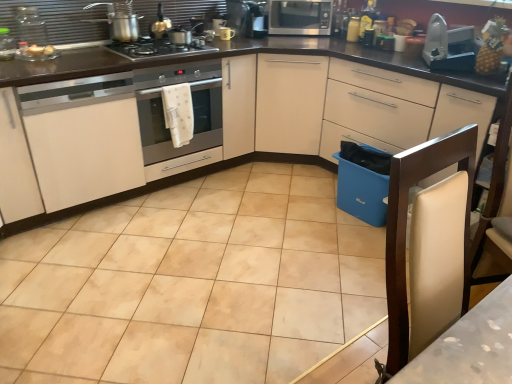
Question: Are satin silver microwave at upper center and white leather chair at right making contact?

Choices:
 (A) no
 (B) yes

Answer: (A)

Question: Does satin silver microwave at upper center come behind white leather chair at right?

Choices:
 (A) no
 (B) yes

Answer: (B)

Question: From a real-world perspective, is satin silver microwave at upper center positioned over white leather chair at right based on gravity?

Choices:
 (A) no
 (B) yes

Answer: (B)

Question: Is satin silver microwave at upper center turned away from white leather chair at right?

Choices:
 (A) yes
 (B) no

Answer: (B)

Question: Considering the relative positions of satin silver microwave at upper center and white leather chair at right in the image provided, is satin silver microwave at upper center to the right of white leather chair at right from the viewer's perspective?

Choices:
 (A) no
 (B) yes

Answer: (A)

Question: Is white matte cabinet at left, the first cabinetry positioned from the left, in front of or behind metallic silver kettle at upper center, arranged as the fifth appliance when viewed from the right, in the image?

Choices:
 (A) behind
 (B) front

Answer: (B)

Question: Is white matte cabinet at left, the second cabinetry from the right, wider or thinner than metallic silver kettle at upper center, arranged as the fifth appliance when viewed from the right?

Choices:
 (A) wide
 (B) thin

Answer: (A)

Question: Considering the positions of point (105, 178) and point (158, 38), is point (105, 178) closer or farther from the camera than point (158, 38)?

Choices:
 (A) closer
 (B) farther

Answer: (A)

Question: From a real-world perspective, is white matte cabinet at left, the second cabinetry from the right, positioned above or below metallic silver kettle at upper center, arranged as the fifth appliance when viewed from the right?

Choices:
 (A) below
 (B) above

Answer: (A)

Question: Considering their positions, is yellow matte jar at upper right, which is the fifth appliance from left to right, located in front of or behind metallic silver coffee maker at upper center, the 4th appliance in the left-to-right sequence?

Choices:
 (A) front
 (B) behind

Answer: (A)

Question: Is yellow matte jar at upper right, which is the fifth appliance from left to right, taller or shorter than metallic silver coffee maker at upper center, the 4th appliance in the left-to-right sequence?

Choices:
 (A) tall
 (B) short

Answer: (B)

Question: Is point (355, 24) positioned closer to the camera than point (259, 11)?

Choices:
 (A) closer
 (B) farther

Answer: (A)

Question: From a real-world perspective, is yellow matte jar at upper right, which is the fifth appliance from left to right, above or below metallic silver coffee maker at upper center, the 4th appliance in the left-to-right sequence?

Choices:
 (A) below
 (B) above

Answer: (A)

Question: From a real-world perspective, is beige ceramic tile at center physically located above or below metallic gray iron at upper right, which is the 1th appliance in right-to-left order?

Choices:
 (A) below
 (B) above

Answer: (A)

Question: Would you say beige ceramic tile at center is inside or outside metallic gray iron at upper right, placed as the sixth appliance when sorted from left to right?

Choices:
 (A) outside
 (B) inside

Answer: (A)